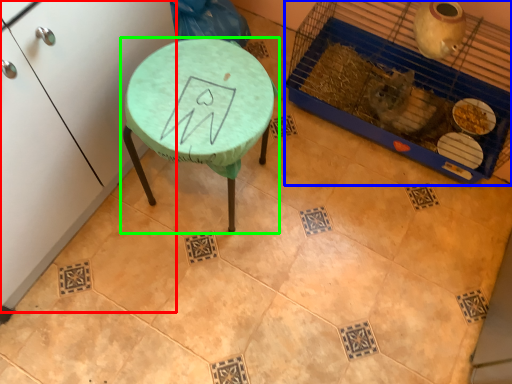
Question: Which is farther away from furniture (highlighted by a red box)? bird cage (highlighted by a blue box) or table (highlighted by a green box)?

Choices:
 (A) bird cage
 (B) table

Answer: (A)